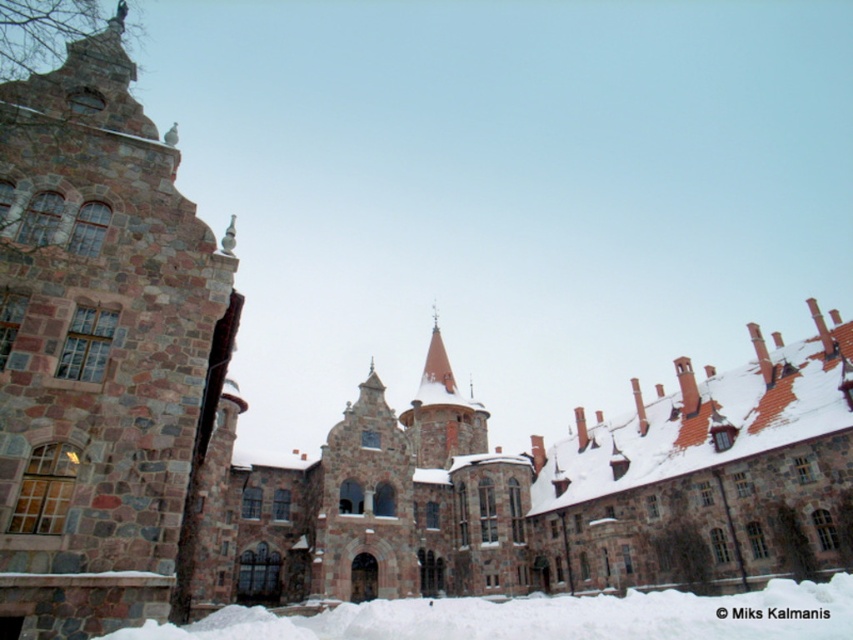
You are standing in front of the grand stone building and notice a specific point marked at coordinates (102, 352). Based on the scene description, what architectural feature does this point most likely indicate?

The point at coordinates (102, 352) corresponds to the rustic stone tower at left.